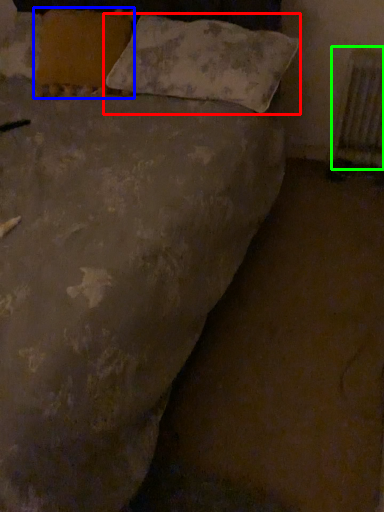
Question: Considering the real-world distances, which object is farthest from pillow (highlighted by a red box)? pillow (highlighted by a blue box) or radiator (highlighted by a green box)?

Choices:
 (A) pillow
 (B) radiator

Answer: (B)